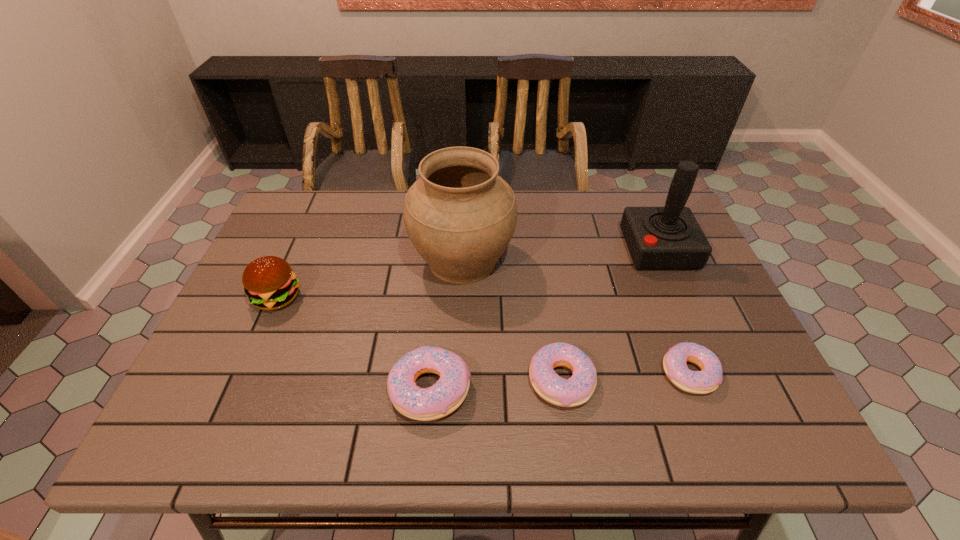
You are a GUI agent. You are given a task and a screenshot of the screen. Output one action in this format:
    pyautogui.click(x=<x>, y=<y>)
    Task: Click on the doughnut that is positioned at the right edge
    Image resolution: width=960 pixels, height=540 pixels.
    Given the screenshot: What is the action you would take?
    pyautogui.click(x=707, y=380)

You are a GUI agent. You are given a task and a screenshot of the screen. Output one action in this format:
    pyautogui.click(x=<x>, y=<y>)
    Task: Click on the joystick that is at the right edge
    This screenshot has height=540, width=960.
    Given the screenshot: What is the action you would take?
    pyautogui.click(x=658, y=238)

In order to click on object at the far right corner in this screenshot , I will do `click(658, 238)`.

Where is `object that is at the near right corner`? object that is at the near right corner is located at coordinates (707, 380).

This screenshot has height=540, width=960. Identify the location of vacant point at the far edge. (612, 231).

This screenshot has height=540, width=960. I want to click on vacant region at the near edge of the desktop, so click(x=503, y=370).

The width and height of the screenshot is (960, 540). In the image, there is a desktop. What are the coordinates of `free space at the right edge` in the screenshot? It's located at 721,356.

Where is `vacant area at the far left corner of the desktop`? This screenshot has height=540, width=960. vacant area at the far left corner of the desktop is located at coordinates (285, 219).

I want to click on vacant space at the near left corner of the desktop, so click(242, 384).

Identify the location of empty space that is in between the joystick and the leftmost doughnut. (544, 319).